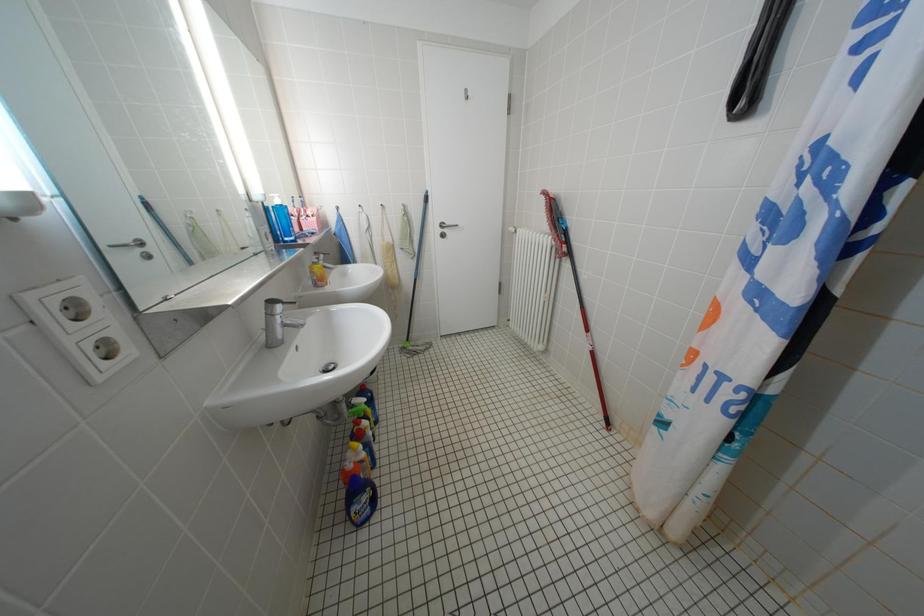
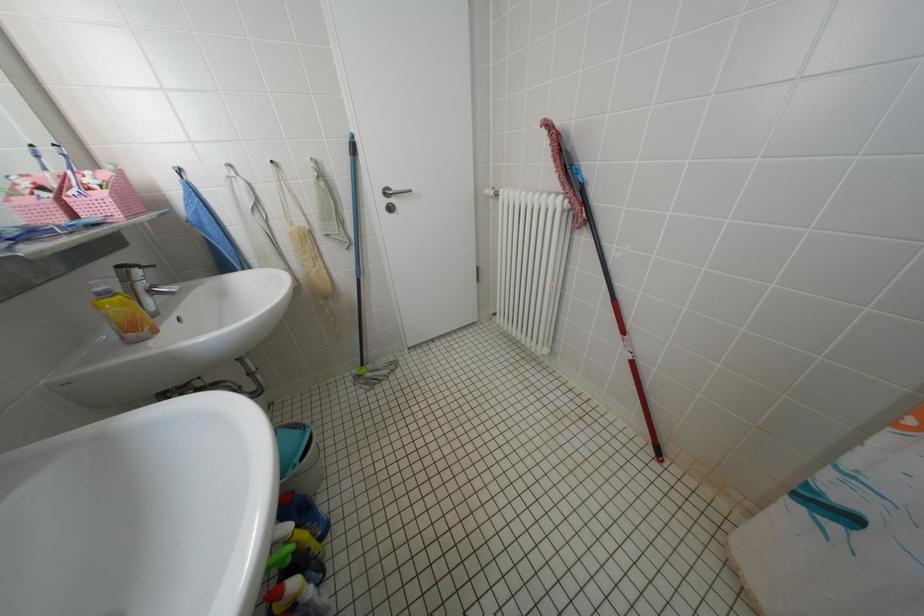
Question: The images are taken continuously from a first-person perspective. In which direction are you moving?

Choices:
 (A) Left
 (B) Right
 (C) Forward
 (D) Backward

Answer: (C)